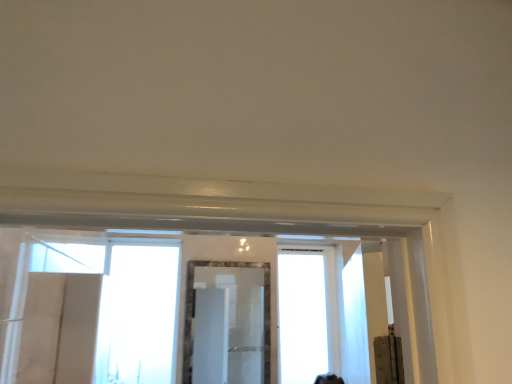
Question: Which direction should I rotate to look at transparent glass window at center, which is counted as the 1th window, starting from the left, — up or down?

Choices:
 (A) up
 (B) down

Answer: (B)

Question: Is marble frame mirror at center at the back of transparent glass window at center, which is counted as the 1th window, starting from the left?

Choices:
 (A) yes
 (B) no

Answer: (B)

Question: Is transparent glass window at center, which is counted as the 1th window, starting from the left, bigger than marble frame mirror at center?

Choices:
 (A) no
 (B) yes

Answer: (B)

Question: From the image's perspective, would you say transparent glass window at center, which is counted as the 1th window, starting from the left, is shown under marble frame mirror at center?

Choices:
 (A) no
 (B) yes

Answer: (A)

Question: Is marble frame mirror at center surrounded by transparent glass window at center, which is counted as the 1th window, starting from the left?

Choices:
 (A) no
 (B) yes

Answer: (A)

Question: Is transparent glass window at center, which is counted as the 1th window, starting from the left, shorter than marble frame mirror at center?

Choices:
 (A) yes
 (B) no

Answer: (B)

Question: Is transparent glass window at center, which is counted as the 1th window, starting from the left, not inside marble frame mirror at center?

Choices:
 (A) yes
 (B) no

Answer: (A)

Question: Can you confirm if transparent glass window at center, positioned as the 2th window in right-to-left order, is shorter than transparent glass window at center, which ranks as the second window in left-to-right order?

Choices:
 (A) no
 (B) yes

Answer: (B)

Question: From a real-world perspective, is transparent glass window at center, which is counted as the 1th window, starting from the left, located beneath transparent glass window at center, the first window positioned from the right?

Choices:
 (A) yes
 (B) no

Answer: (B)

Question: Is transparent glass window at center, which is counted as the 1th window, starting from the left, next to transparent glass window at center, the first window positioned from the right, and touching it?

Choices:
 (A) yes
 (B) no

Answer: (B)

Question: Does transparent glass window at center, positioned as the 2th window in right-to-left order, have a greater height compared to transparent glass window at center, the first window positioned from the right?

Choices:
 (A) yes
 (B) no

Answer: (B)

Question: Is transparent glass window at center, which is counted as the 1th window, starting from the left, not close to transparent glass window at center, which ranks as the second window in left-to-right order?

Choices:
 (A) no
 (B) yes

Answer: (B)

Question: Is the depth of transparent glass window at center, positioned as the 2th window in right-to-left order, less than that of transparent glass window at center, which ranks as the second window in left-to-right order?

Choices:
 (A) no
 (B) yes

Answer: (B)

Question: Does marble frame mirror at center have a larger size compared to transparent glass window at center, positioned as the 2th window in right-to-left order?

Choices:
 (A) yes
 (B) no

Answer: (B)